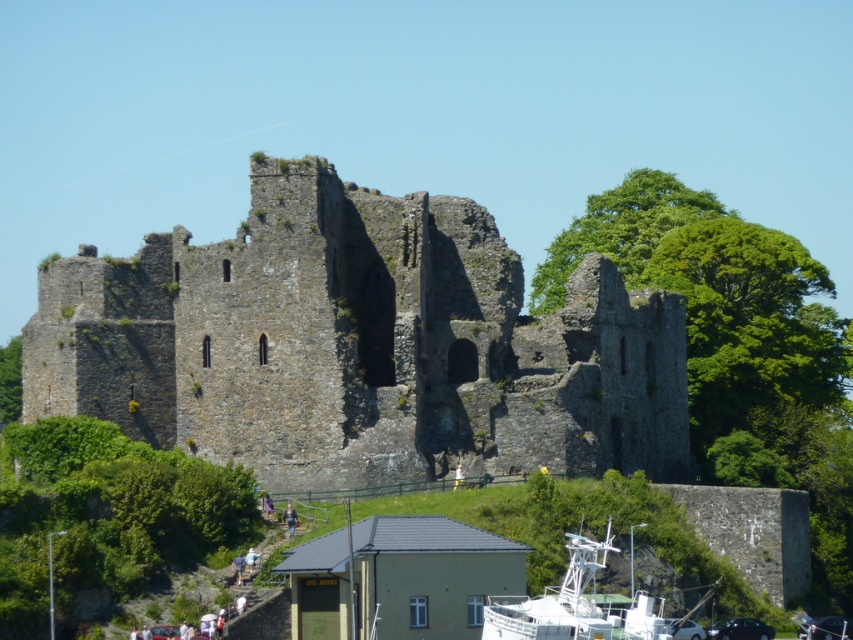
Question: From the image, what is the correct spatial relationship of rough stone castle at center in relation to white plastic boat at lower right?

Choices:
 (A) left
 (B) right

Answer: (A)

Question: Which point is farther from the camera taking this photo?

Choices:
 (A) (608, 624)
 (B) (440, 259)

Answer: (B)

Question: Which object is farther from the camera taking this photo?

Choices:
 (A) white plastic boat at lower right
 (B) rough stone castle at center

Answer: (B)

Question: Which point is closer to the camera?

Choices:
 (A) (584, 580)
 (B) (374, 369)

Answer: (A)

Question: Can you confirm if rough stone castle at center is positioned to the left of white plastic boat at lower right?

Choices:
 (A) no
 (B) yes

Answer: (B)

Question: Is rough stone castle at center closer to the viewer compared to white plastic boat at lower right?

Choices:
 (A) no
 (B) yes

Answer: (A)